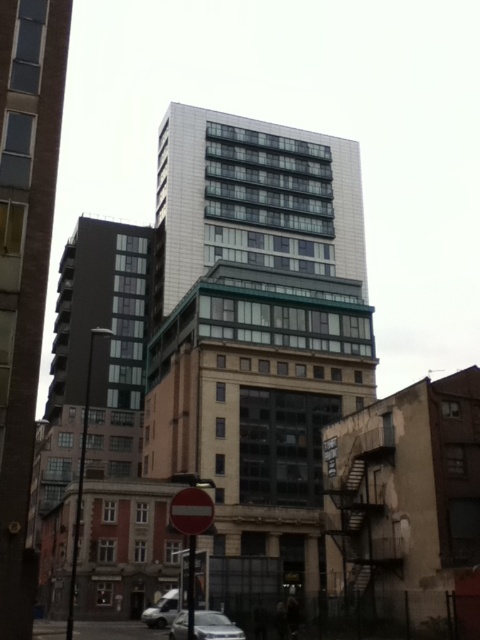
Question: Does green glass building at center have a smaller size compared to red matte stop sign at center?

Choices:
 (A) yes
 (B) no

Answer: (B)

Question: Considering the real-world distances, which object is closest to the silver metallic car at lower center?

Choices:
 (A) silver metallic van at lower center
 (B) matte glass building at center
 (C) red matte stop sign at center
 (D) green glass building at center

Answer: (B)

Question: Which of the following is the farthest from the observer?

Choices:
 (A) red matte stop sign at center
 (B) green glass building at center
 (C) silver metallic van at lower center
 (D) red plastic sign at lower center

Answer: (C)

Question: Can you confirm if green glass building at center is positioned below red plastic sign at lower center?

Choices:
 (A) yes
 (B) no

Answer: (B)

Question: Which object is farther from the camera taking this photo?

Choices:
 (A) silver metallic van at lower center
 (B) red matte stop sign at center
 (C) silver metallic car at lower center

Answer: (A)

Question: In this image, where is matte glass building at center located relative to red matte stop sign at center?

Choices:
 (A) right
 (B) left

Answer: (B)